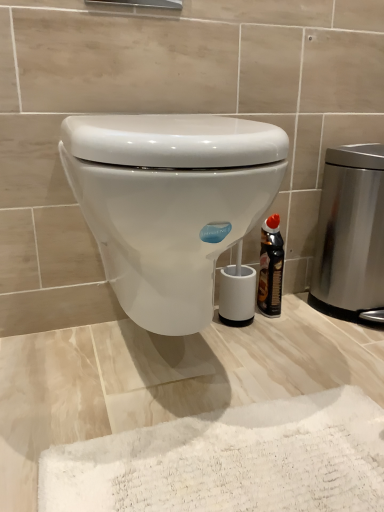
Identify the location of stainless steel trash can at right. (351, 233).

Based on the photo, from the image's perspective, does black glossy bottle at right appear lower than stainless steel trash can at right?

Yes, from the image's perspective, black glossy bottle at right is below stainless steel trash can at right.

From their relative heights in the image, would you say black glossy bottle at right is taller or shorter than stainless steel trash can at right?

Considering their sizes, black glossy bottle at right has less height than stainless steel trash can at right.

Is black glossy bottle at right inside the boundaries of stainless steel trash can at right, or outside?

black glossy bottle at right is not inside stainless steel trash can at right, it's outside.

The image size is (384, 512). In order to click on appliance located on the right of black glossy bottle at right in this screenshot , I will do `click(351, 233)`.

I want to click on toilet that is above the stainless steel trash can at right (from a real-world perspective), so click(x=170, y=203).

Is stainless steel trash can at right shorter than white glossy toilet at center?

No, stainless steel trash can at right is not shorter than white glossy toilet at center.

Is stainless steel trash can at right bigger than white glossy toilet at center?

No, stainless steel trash can at right is not bigger than white glossy toilet at center.

Which object is further away from the camera, stainless steel trash can at right or white glossy toilet at center?

stainless steel trash can at right is further from the camera.

Between stainless steel trash can at right and black glossy bottle at right, which one has larger width?

stainless steel trash can at right.

From the image's perspective, would you say stainless steel trash can at right is shown under black glossy bottle at right?

No.

Is stainless steel trash can at right far from black glossy bottle at right?

stainless steel trash can at right is near black glossy bottle at right, not far away.

Is white glossy toilet at center outside of black glossy bottle at right?

Yes.

Considering the positions of objects white glossy toilet at center and black glossy bottle at right in the image provided, who is more to the right, white glossy toilet at center or black glossy bottle at right?

From the viewer's perspective, black glossy bottle at right appears more on the right side.

Which is in front, point (155, 123) or point (259, 276)?

The point (155, 123) is closer to the camera.

Which of these two, white glossy toilet at center or black glossy bottle at right, is smaller?

black glossy bottle at right is smaller.

Is black glossy bottle at right thinner than white glossy toilet at center?

Indeed, black glossy bottle at right has a lesser width compared to white glossy toilet at center.

Is black glossy bottle at right turned away from white glossy toilet at center?

No, black glossy bottle at right's orientation is not away from white glossy toilet at center.

From their relative heights in the image, would you say black glossy bottle at right is taller or shorter than white glossy toilet at center?

Considering their sizes, black glossy bottle at right has less height than white glossy toilet at center.

Based on their positions, is black glossy bottle at right located to the left or right of white glossy toilet at center?

In the image, black glossy bottle at right appears on the right side of white glossy toilet at center.

The width and height of the screenshot is (384, 512). I want to click on appliance lying behind the white glossy toilet at center, so click(351, 233).

From the image's perspective, which one is positioned higher, white glossy toilet at center or stainless steel trash can at right?

stainless steel trash can at right appears higher in the image.

Is white glossy toilet at center placed right next to stainless steel trash can at right?

No, white glossy toilet at center is not in contact with stainless steel trash can at right.

Is white glossy toilet at center closer to camera compared to stainless steel trash can at right?

Yes.

Where is `bottle that appears on the left of stainless steel trash can at right`? Image resolution: width=384 pixels, height=512 pixels. bottle that appears on the left of stainless steel trash can at right is located at coordinates (270, 267).

Locate an element on the screen. The height and width of the screenshot is (512, 384). appliance below the white glossy toilet at center (from a real-world perspective) is located at coordinates (351, 233).

Which object lies nearer to the anchor point black glossy bottle at right, white glossy toilet at center or stainless steel trash can at right?

stainless steel trash can at right.

From the image, which object appears to be farther from stainless steel trash can at right, black glossy bottle at right or white glossy toilet at center?

white glossy toilet at center is further to stainless steel trash can at right.

Looking at the image, which one is located closer to white glossy toilet at center, black glossy bottle at right or stainless steel trash can at right?

Among the two, black glossy bottle at right is located nearer to white glossy toilet at center.

Considering their positions, is white glossy toilet at center positioned closer to stainless steel trash can at right than black glossy bottle at right?

The object closer to stainless steel trash can at right is black glossy bottle at right.

Looking at the image, which one is located closer to white glossy toilet at center, stainless steel trash can at right or black glossy bottle at right?

The object closer to white glossy toilet at center is black glossy bottle at right.

Estimate the real-world distances between objects in this image. Which object is closer to black glossy bottle at right, stainless steel trash can at right or white glossy toilet at center?

Based on the image, stainless steel trash can at right appears to be nearer to black glossy bottle at right.

Where is `appliance between white glossy toilet at center and black glossy bottle at right in the front-back direction`? This screenshot has height=512, width=384. appliance between white glossy toilet at center and black glossy bottle at right in the front-back direction is located at coordinates (351, 233).